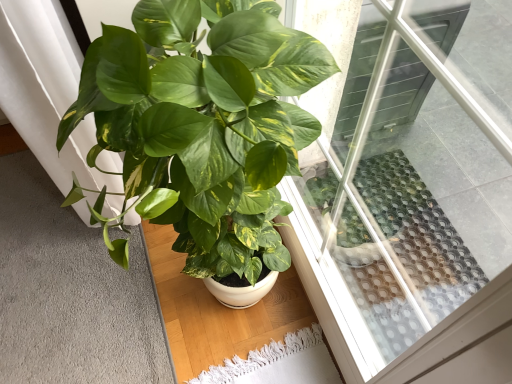
Identify the location of vacant region above soft gray carpet at lower left (from a real-world perspective). The width and height of the screenshot is (512, 384). (65, 274).